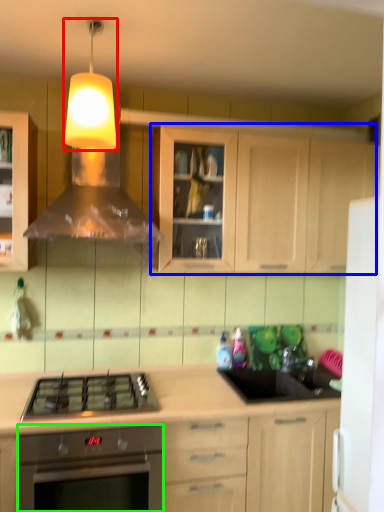
Question: Estimate the real-world distances between objects in this image. Which object is closer to light fixture (highlighted by a red box), cabinetry (highlighted by a blue box) or oven (highlighted by a green box)?

Choices:
 (A) cabinetry
 (B) oven

Answer: (A)